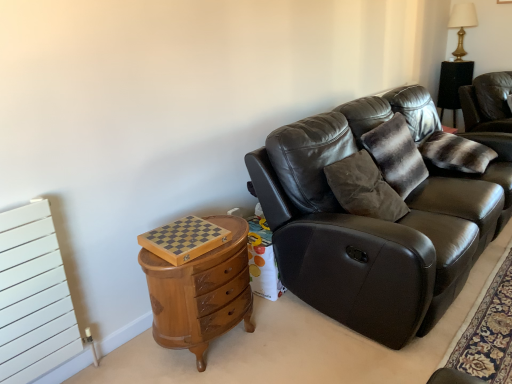
The image size is (512, 384). Find the location of `vacant space to the right of wooden chest of drawers at left`. vacant space to the right of wooden chest of drawers at left is located at coordinates (292, 337).